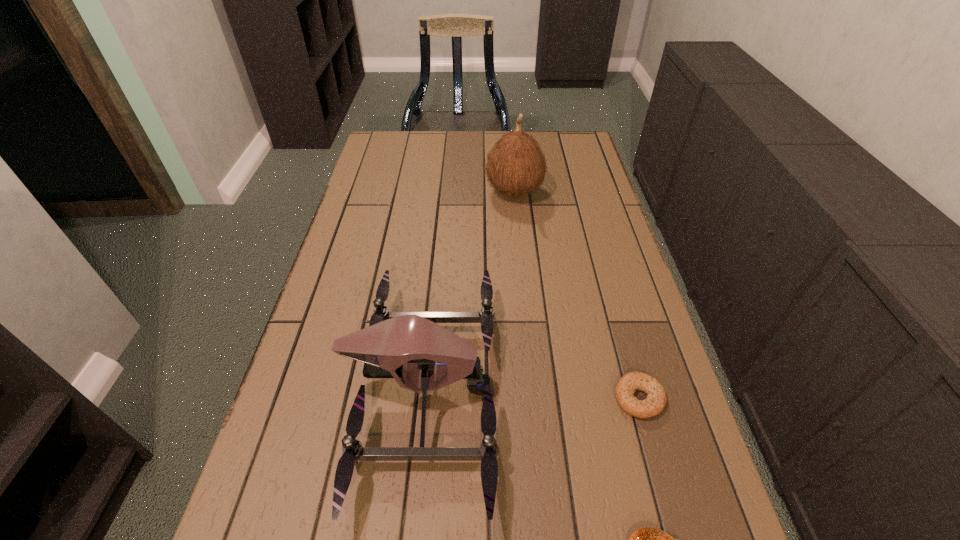
Locate an element on the screen. The height and width of the screenshot is (540, 960). the farthest object is located at coordinates (516, 165).

Where is `the tallest object`? the tallest object is located at coordinates click(x=516, y=165).

The width and height of the screenshot is (960, 540). Find the location of `drone`. drone is located at coordinates (409, 345).

You are a GUI agent. You are given a task and a screenshot of the screen. Output one action in this format:
    pyautogui.click(x=<x>, y=<y>)
    Task: Click on the farther bagel
    
    Given the screenshot: What is the action you would take?
    pyautogui.click(x=656, y=399)

Where is `free space located on the surface of the coconut`? The width and height of the screenshot is (960, 540). free space located on the surface of the coconut is located at coordinates (450, 192).

I want to click on vacant region located 0.360m on the surface of the coconut, so click(372, 192).

Locate an element on the screen. vacant space located on the surface of the coconut is located at coordinates coord(420,192).

Identify the location of free location located 0.220m on the front-facing side of the second tallest object. This screenshot has width=960, height=540. (602, 390).

This screenshot has width=960, height=540. Identify the location of free space located 0.110m on the front of the farther bagel. (661, 478).

The height and width of the screenshot is (540, 960). Identify the location of object located in the left edge section of the desktop. (409, 345).